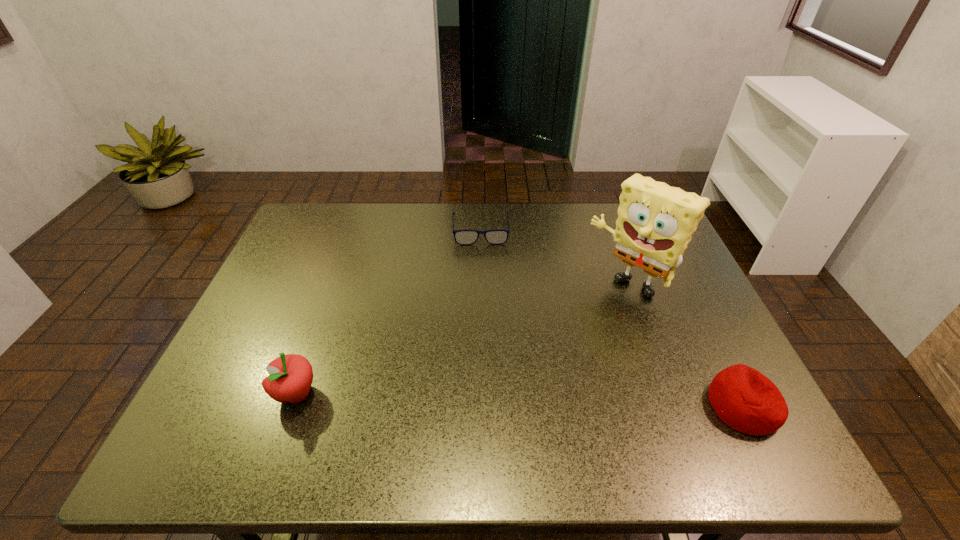
Identify the location of vacant space on the desktop that is between the apple and the beanbag and is positioned on the front-facing side of the spectacles. This screenshot has height=540, width=960. (490, 399).

Identify the location of vacant space on the desktop that is between the leftmost object and the beanbag and is positioned on the face of the third nearest object. (521, 400).